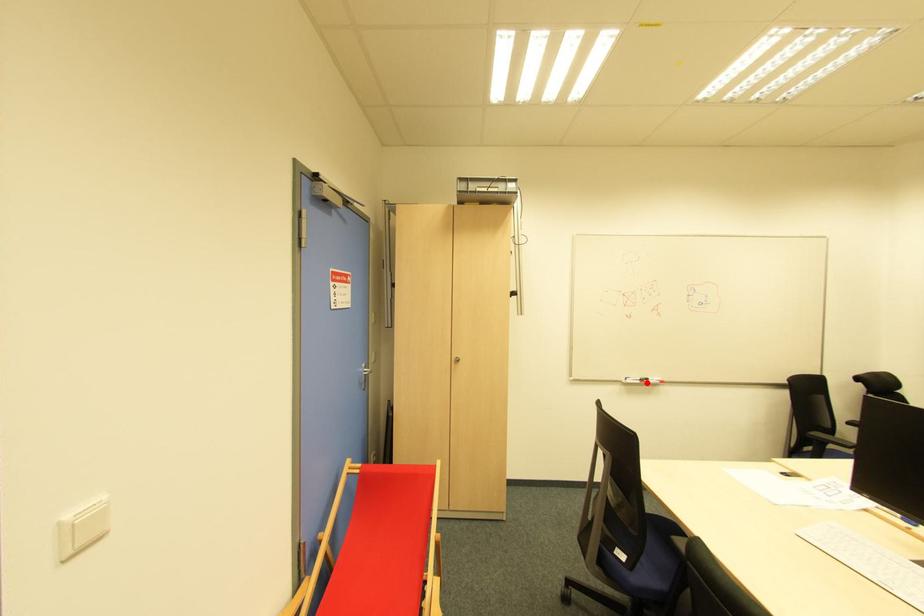
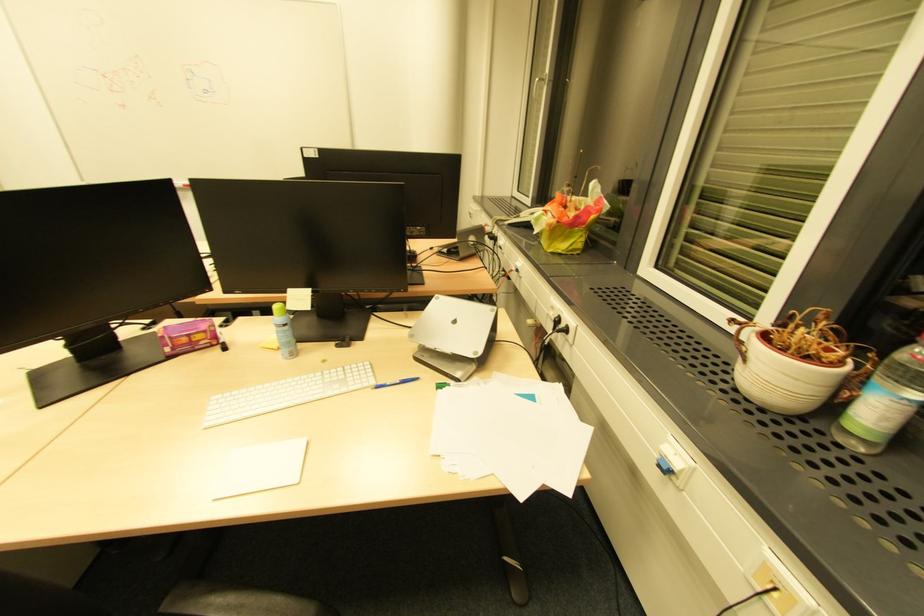
Question: I am providing you with two images of the same scene from different viewpoints. A red point is marked on the first image. Is the red point's position out of view in image 2?

Choices:
 (A) Yes
 (B) No

Answer: (A)